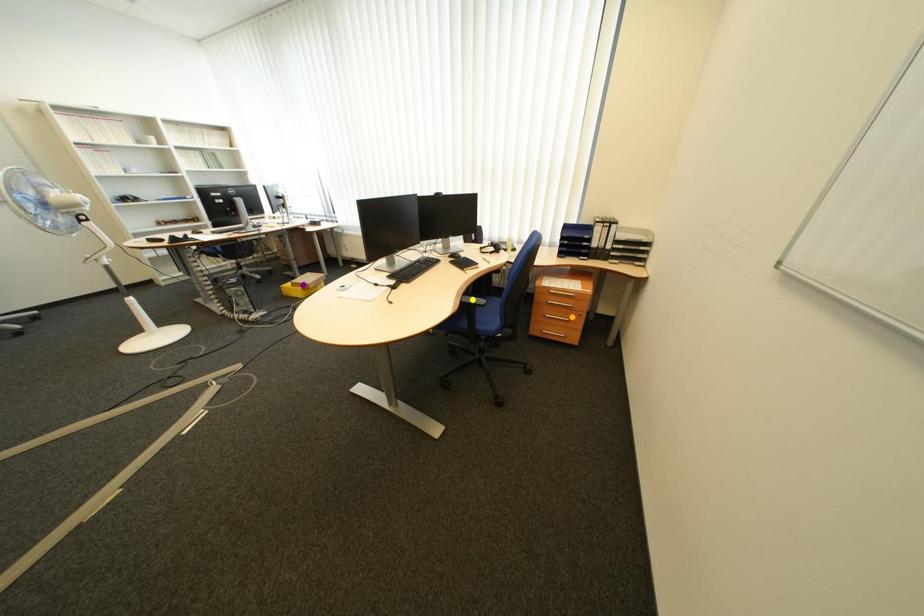
Order these from nearest to farthest:
purple point
orange point
yellow point

yellow point < orange point < purple point